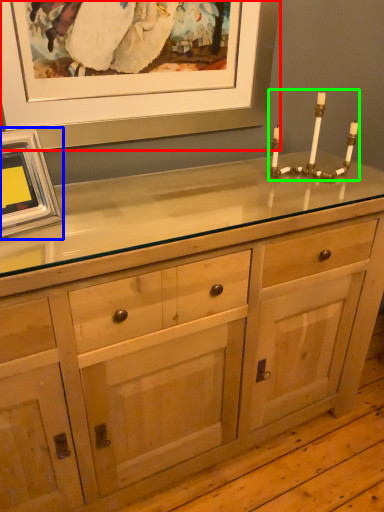
Question: Which object is the farthest from picture frame (highlighted by a red box)? Choose among these: picture frame (highlighted by a blue box) or candle holder (highlighted by a green box).

Choices:
 (A) picture frame
 (B) candle holder

Answer: (A)